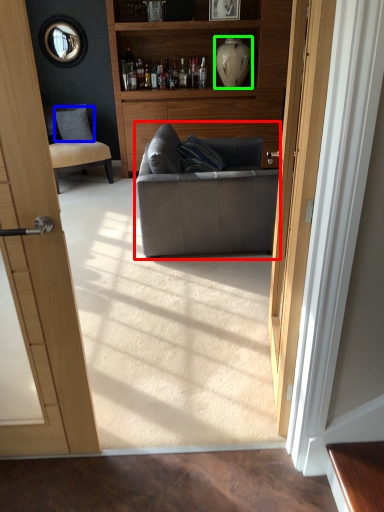
Question: Which is farther away from studio couch (highlighted by a red box)? pillow (highlighted by a blue box) or vase (highlighted by a green box)?

Choices:
 (A) pillow
 (B) vase

Answer: (A)